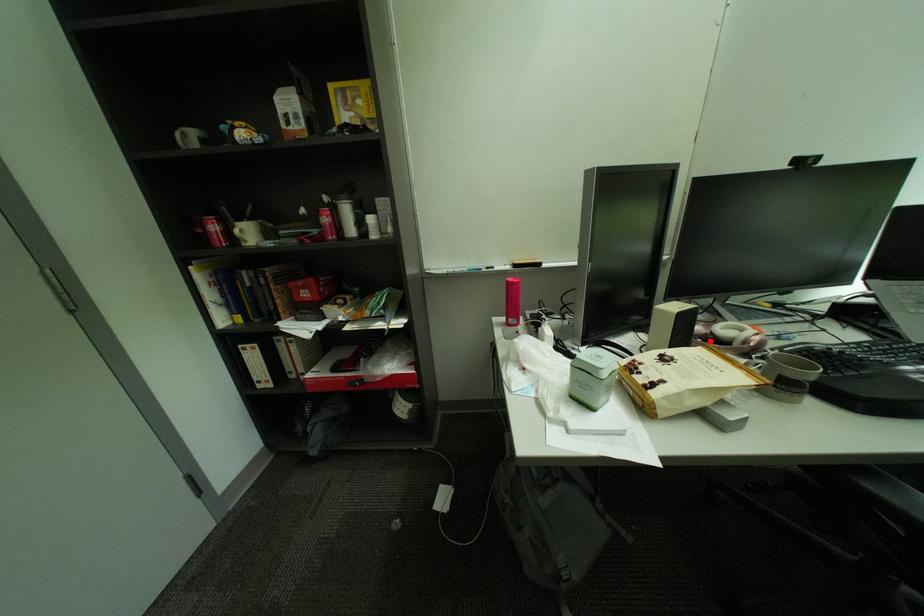
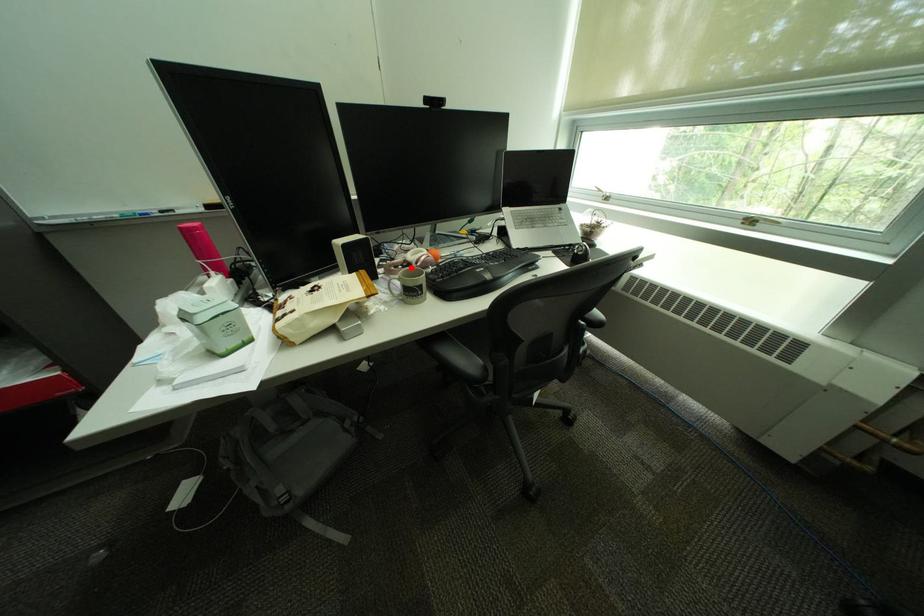
I am providing you with two images of the same scene from different viewpoints. A red point is marked on the first image and another point is marked on the second image. Are the points marked in image1 and image2 representing the same 3D position?

Yes